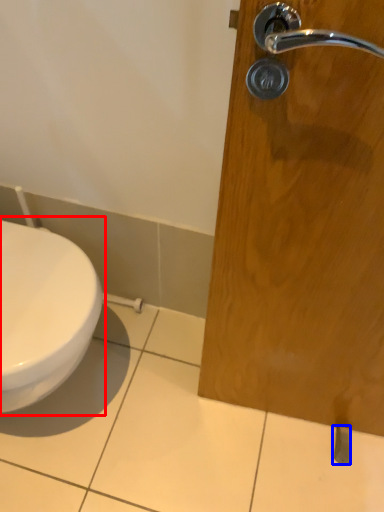
Question: Which point is closer to the camera, toilet (highlighted by a red box) or door handle (highlighted by a blue box)?

Choices:
 (A) toilet
 (B) door handle

Answer: (A)